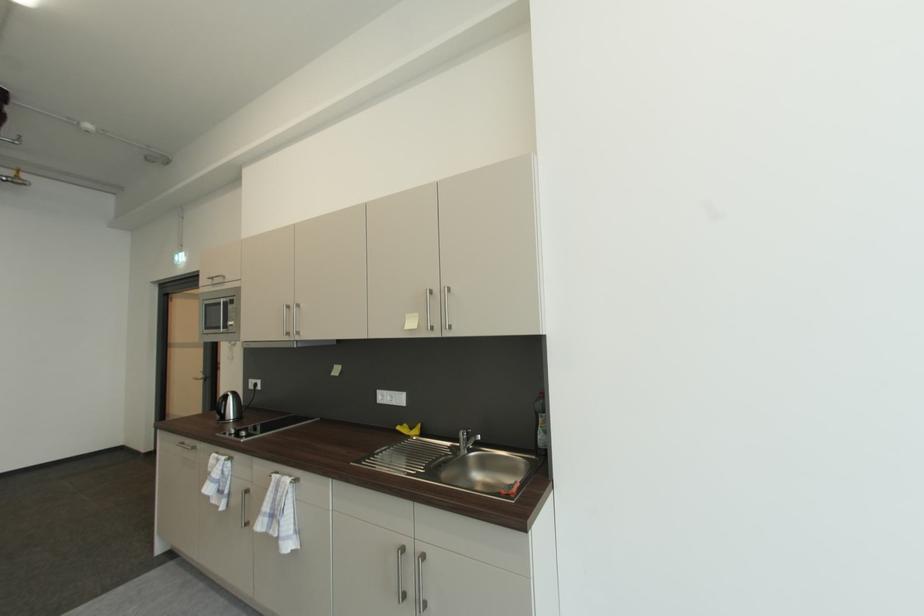
This screenshot has width=924, height=616. What are the coordinates of `yellow kitchen sponge` in the screenshot? It's located at (408, 429).